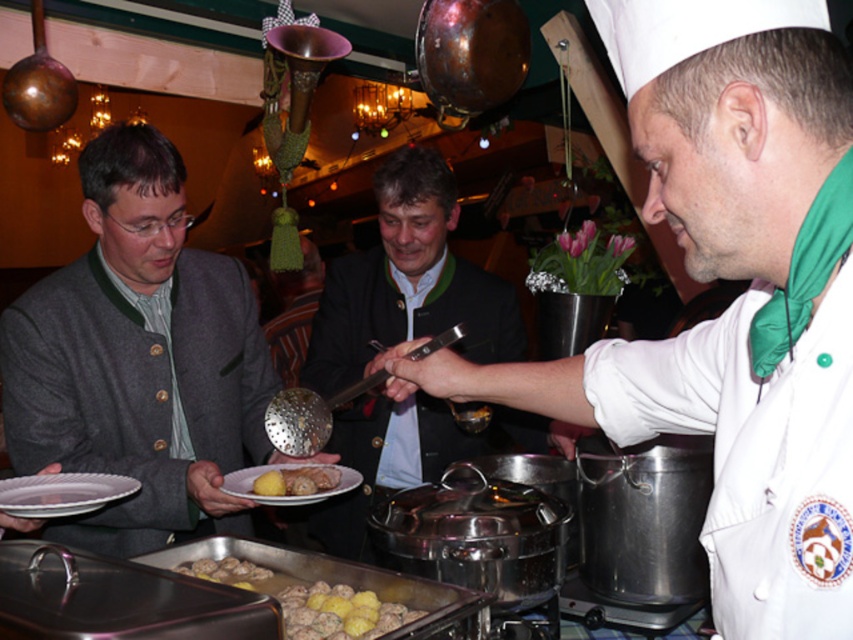
You are a guest at the buffet and want to reach the chef serving food from the large silver pot. You are currently at point (86, 280) and need to get to point (389, 612). Is there any obstacle between your current position and the chef?

Point (86, 280) is behind point (389, 612), so there might be an obstacle between them. You should check the path carefully before moving forward.

You are a guest at the buffet and want to reach the golden brown meatballs with yellow potatoes at center without disturbing the chef. Can you see them clearly from where the gray woolen jacket at left is located?

The gray woolen jacket at left is taller than the golden brown meatballs with yellow potatoes at center, so it might block your view. You may need to move around it to see the meatballs clearly.